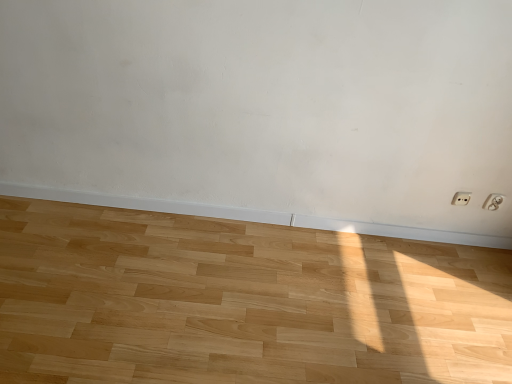
This screenshot has height=384, width=512. I want to click on white plastic electric outlet at lower right, the second electric outlet viewed from the right, so click(x=461, y=198).

Measure the distance between point (494, 194) and camera.

They are 1.88 meters apart.

I want to click on white plastic electric outlet at lower right, which is the first electric outlet from left to right, so click(461, 198).

Is natural wood floor at center surrounded by white plastic electric outlet at lower right, the second electric outlet viewed from the right?

No, white plastic electric outlet at lower right, the second electric outlet viewed from the right, does not contain natural wood floor at center.

Is white plastic electric outlet at lower right, the second electric outlet viewed from the right, smaller than natural wood floor at center?

Yes.

From a real-world perspective, between white plastic electric outlet at lower right, the second electric outlet viewed from the right, and natural wood floor at center, who is vertically higher?

white plastic electric outlet at lower right, the second electric outlet viewed from the right.

Which of these two, white plastic electric outlet at lower right, the second electric outlet viewed from the right, or natural wood floor at center, is wider?

natural wood floor at center is wider.

Is point (496, 204) closer or farther from the camera than point (452, 203)?

Point (496, 204).

Choose the correct answer: Is white plastic electric outlet at lower right, the 2th electric outlet when ordered from left to right, inside white plastic electric outlet at lower right, which is the first electric outlet from left to right, or outside it?

white plastic electric outlet at lower right, the 2th electric outlet when ordered from left to right, is not inside white plastic electric outlet at lower right, which is the first electric outlet from left to right, it's outside.

Where is `electric outlet above the white plastic electric outlet at lower right, which is counted as the 1th electric outlet, starting from the right (from the image's perspective)`? Image resolution: width=512 pixels, height=384 pixels. electric outlet above the white plastic electric outlet at lower right, which is counted as the 1th electric outlet, starting from the right (from the image's perspective) is located at coordinates (461, 198).

Is natural wood floor at center positioned far away from white plastic electric outlet at lower right, which is the first electric outlet from left to right?

Indeed, natural wood floor at center is not near white plastic electric outlet at lower right, which is the first electric outlet from left to right.

Between natural wood floor at center and white plastic electric outlet at lower right, which is the first electric outlet from left to right, which one appears on the right side from the viewer's perspective?

From the viewer's perspective, white plastic electric outlet at lower right, which is the first electric outlet from left to right, appears more on the right side.

Is natural wood floor at center not within white plastic electric outlet at lower right, which is the first electric outlet from left to right?

Absolutely, natural wood floor at center is external to white plastic electric outlet at lower right, which is the first electric outlet from left to right.

Based on the photo, between natural wood floor at center and white plastic electric outlet at lower right, which is the first electric outlet from left to right, which one is positioned behind?

white plastic electric outlet at lower right, which is the first electric outlet from left to right, is more distant.

Is white plastic electric outlet at lower right, which is the first electric outlet from left to right, next to white plastic electric outlet at lower right, the 2th electric outlet when ordered from left to right?

No, white plastic electric outlet at lower right, which is the first electric outlet from left to right, is not beside white plastic electric outlet at lower right, the 2th electric outlet when ordered from left to right.

Visually, is white plastic electric outlet at lower right, which is the first electric outlet from left to right, positioned to the left or to the right of white plastic electric outlet at lower right, which is counted as the 1th electric outlet, starting from the right?

Clearly, white plastic electric outlet at lower right, which is the first electric outlet from left to right, is on the left of white plastic electric outlet at lower right, which is counted as the 1th electric outlet, starting from the right, in the image.

Considering the points (466, 204) and (502, 201), which point is behind, point (466, 204) or point (502, 201)?

Positioned behind is point (466, 204).

From the image's perspective, between white plastic electric outlet at lower right, the second electric outlet viewed from the right, and white plastic electric outlet at lower right, which is counted as the 1th electric outlet, starting from the right, who is located below?

white plastic electric outlet at lower right, which is counted as the 1th electric outlet, starting from the right, from the image's perspective.

Consider the image. Could you tell me if natural wood floor at center is facing white plastic electric outlet at lower right, which is counted as the 1th electric outlet, starting from the right?

No, natural wood floor at center is not turned towards white plastic electric outlet at lower right, which is counted as the 1th electric outlet, starting from the right.

Looking at this image, which is more to the left, natural wood floor at center or white plastic electric outlet at lower right, which is counted as the 1th electric outlet, starting from the right?

From the viewer's perspective, natural wood floor at center appears more on the left side.

Which of these two, natural wood floor at center or white plastic electric outlet at lower right, which is counted as the 1th electric outlet, starting from the right, stands taller?

With more height is white plastic electric outlet at lower right, which is counted as the 1th electric outlet, starting from the right.

Which is closer to the camera, (69,245) or (490,207)?

Positioned in front is point (69,245).

In the scene shown: From their relative heights in the image, would you say white plastic electric outlet at lower right, the 2th electric outlet when ordered from left to right, is taller or shorter than natural wood floor at center?

Clearly, white plastic electric outlet at lower right, the 2th electric outlet when ordered from left to right, is taller compared to natural wood floor at center.

Is white plastic electric outlet at lower right, the 2th electric outlet when ordered from left to right, surrounding natural wood floor at center?

That's incorrect, natural wood floor at center is not inside white plastic electric outlet at lower right, the 2th electric outlet when ordered from left to right.

Can you tell me how much white plastic electric outlet at lower right, the 2th electric outlet when ordered from left to right, and natural wood floor at center differ in facing direction?

white plastic electric outlet at lower right, the 2th electric outlet when ordered from left to right, and natural wood floor at center are facing 90 degrees away from each other.

Locate an element on the screen. hardwood on the left of white plastic electric outlet at lower right, which is the first electric outlet from left to right is located at coordinates (241, 302).

Locate an element on the screen. This screenshot has height=384, width=512. electric outlet that is above the white plastic electric outlet at lower right, which is counted as the 1th electric outlet, starting from the right (from the image's perspective) is located at coordinates (461, 198).

From the image, which object appears to be nearer to natural wood floor at center, white plastic electric outlet at lower right, the second electric outlet viewed from the right, or white plastic electric outlet at lower right, which is counted as the 1th electric outlet, starting from the right?

Among the two, white plastic electric outlet at lower right, the second electric outlet viewed from the right, is located nearer to natural wood floor at center.

Which object lies nearer to the anchor point white plastic electric outlet at lower right, which is the first electric outlet from left to right, natural wood floor at center or white plastic electric outlet at lower right, the 2th electric outlet when ordered from left to right?

Among the two, white plastic electric outlet at lower right, the 2th electric outlet when ordered from left to right, is located nearer to white plastic electric outlet at lower right, which is the first electric outlet from left to right.

Looking at the image, which one is located closer to white plastic electric outlet at lower right, which is counted as the 1th electric outlet, starting from the right, natural wood floor at center or white plastic electric outlet at lower right, which is the first electric outlet from left to right?

white plastic electric outlet at lower right, which is the first electric outlet from left to right, is positioned closer to the anchor white plastic electric outlet at lower right, which is counted as the 1th electric outlet, starting from the right.

Considering their positions, is white plastic electric outlet at lower right, which is the first electric outlet from left to right, positioned further to white plastic electric outlet at lower right, the 2th electric outlet when ordered from left to right, than natural wood floor at center?

natural wood floor at center.

Looking at the image, which one is located further to white plastic electric outlet at lower right, the second electric outlet viewed from the right, white plastic electric outlet at lower right, the 2th electric outlet when ordered from left to right, or natural wood floor at center?

The object further to white plastic electric outlet at lower right, the second electric outlet viewed from the right, is natural wood floor at center.

Estimate the real-world distances between objects in this image. Which object is closer to natural wood floor at center, white plastic electric outlet at lower right, which is counted as the 1th electric outlet, starting from the right, or white plastic electric outlet at lower right, the second electric outlet viewed from the right?

The object closer to natural wood floor at center is white plastic electric outlet at lower right, the second electric outlet viewed from the right.

Locate an element on the screen. electric outlet between natural wood floor at center and white plastic electric outlet at lower right, which is counted as the 1th electric outlet, starting from the right, in the horizontal direction is located at coordinates (461, 198).